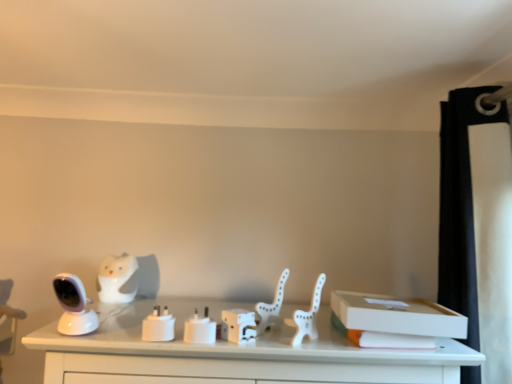
Question: Considering the positions of white matte plastic chair at center and white matte owl at left, marked as the first animal in a left-to-right arrangement, in the image, is white matte plastic chair at center bigger or smaller than white matte owl at left, marked as the first animal in a left-to-right arrangement,?

Choices:
 (A) small
 (B) big

Answer: (B)

Question: Based on their positions, is white matte plastic chair at center located to the left or right of white matte owl at left, the 1th animal in the back-to-front sequence?

Choices:
 (A) right
 (B) left

Answer: (A)

Question: Considering the real-world distances, which object is closest to the white matte plastic box at center, marked as the first box in a left-to-right arrangement?

Choices:
 (A) white cardboard box at right, positioned as the 2th box in left-to-right order
 (B) white matte owl at left, placed as the 2th animal when sorted from right to left
 (C) white matte plastic chair at center
 (D) white matte plug at center
 (E) white plastic animal at center, which is the 1th animal from right to left

Answer: (E)

Question: Based on their relative distances, which object is nearer to the white plastic animal at center, which is the 1th animal from right to left?

Choices:
 (A) white matte owl at left, placed as the 2th animal when sorted from right to left
 (B) white cardboard box at right, the first box viewed from the right
 (C) white matte plastic box at center, marked as the first box in a left-to-right arrangement
 (D) white matte plastic chair at center
 (E) white matte plug at center

Answer: (D)